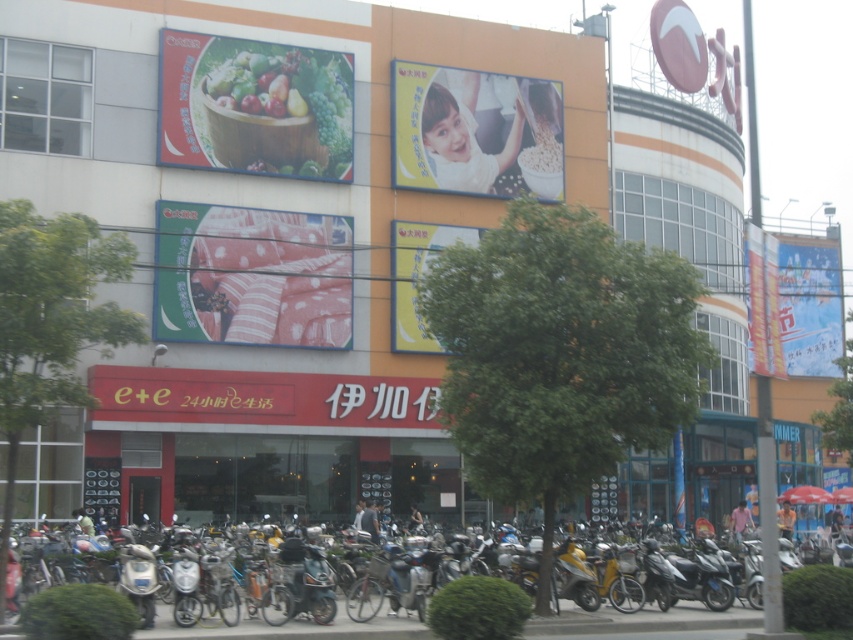
Question: Considering the relative positions of polka dot fabric at center and dark blue shirt at center in the image provided, where is polka dot fabric at center located with respect to dark blue shirt at center?

Choices:
 (A) right
 (B) left

Answer: (B)

Question: Among these points, which one is nearest to the camera?

Choices:
 (A) (523, 560)
 (B) (302, 308)
 (C) (799, 364)

Answer: (A)

Question: Which point is closer to the camera taking this photo?

Choices:
 (A) (572, 600)
 (B) (303, 611)

Answer: (B)

Question: Is light blue shirt at center above orange fabric umbrella at lower right?

Choices:
 (A) yes
 (B) no

Answer: (B)

Question: Does wooden bowl of fruits at upper left have a greater width compared to light brown leather jacket at center?

Choices:
 (A) yes
 (B) no

Answer: (A)

Question: Among these objects, which one is farthest from the camera?

Choices:
 (A) yellow matte scooter at center
 (B) wooden bowl of fruits at upper left
 (C) polka dot fabric at center
 (D) blue paper banner at right

Answer: (B)